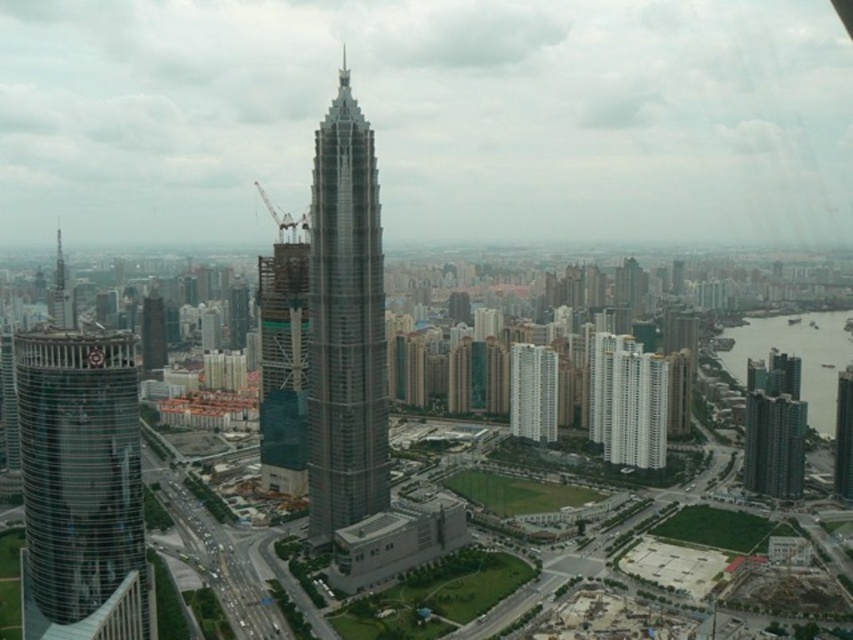
Looking at this image, between shiny glass skyscraper at center and white glass building at center, which one appears on the right side from the viewer's perspective?

white glass building at center is more to the right.

Measure the distance between shiny glass skyscraper at center and white glass building at center.

115.09 meters

Between point (386, 385) and point (526, 380), which one is positioned in front?

Point (386, 385) is in front.

Identify the location of shiny glass skyscraper at center. (345, 324).

Which is more to the left, shiny glass skyscraper at center or shiny glass tower at left?

shiny glass tower at left

Based on the photo, who is lower down, shiny glass skyscraper at center or shiny glass tower at left?

shiny glass skyscraper at center is below.

What are the coordinates of `shiny glass skyscraper at center` in the screenshot? It's located at (345, 324).

Is dark gray glass building at right positioned at the back of white glass building at center?

No, dark gray glass building at right is closer to the viewer.

Looking at this image, who is more forward, (804, 428) or (540, 376)?

Point (804, 428) is in front.

Identify the location of dark gray glass building at right. (775, 444).